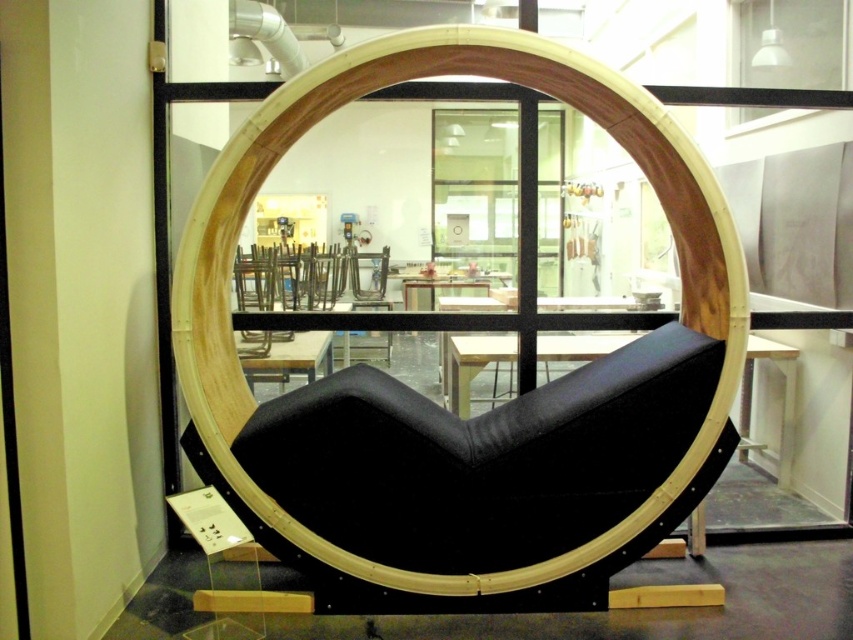
Does transparent glass window at upper center have a lesser width compared to black fabric cushion at center?

Correct, transparent glass window at upper center's width is less than black fabric cushion at center's.

Between transparent glass window at upper center and black fabric cushion at center, which one has less height?

black fabric cushion at center

The width and height of the screenshot is (853, 640). Describe the element at coordinates (790, 44) in the screenshot. I see `transparent glass window at upper center` at that location.

Locate an element on the screen. transparent glass window at upper center is located at coordinates (790, 44).

Who is lower down, black fabric cushion at center or black matte table at center?

black fabric cushion at center

Is black fabric cushion at center bigger than black matte table at center?

Indeed, black fabric cushion at center has a larger size compared to black matte table at center.

Locate an element on the screen. black fabric cushion at center is located at coordinates (473, 364).

How distant is wooden/textured oval at center from black matte table at center?

wooden/textured oval at center and black matte table at center are 4.43 feet apart.

Which of these two, wooden/textured oval at center or black matte table at center, stands shorter?

black matte table at center

Between point (463, 582) and point (451, 394), which one is positioned in front?

Point (463, 582)

At what (x,y) coordinates should I click in order to perform the action: click on wooden/textured oval at center. Please return your answer as a coordinate pair (x, y). The image size is (853, 640). Looking at the image, I should click on (440, 406).